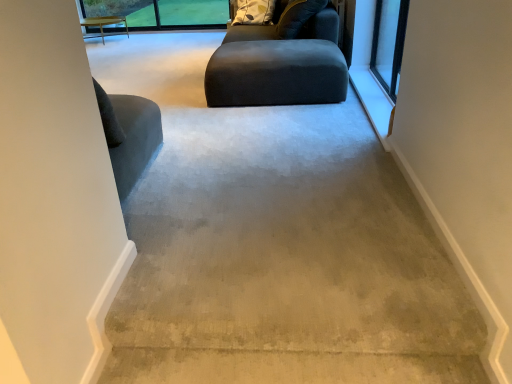
Where is `dark gray fabric bean bag at center`? The image size is (512, 384). dark gray fabric bean bag at center is located at coordinates (321, 25).

In order to click on clear glass window at upper right in this screenshot , I will do `click(389, 43)`.

The width and height of the screenshot is (512, 384). Describe the element at coordinates (389, 43) in the screenshot. I see `clear glass window at upper right` at that location.

Find the location of a particular element. This screenshot has height=384, width=512. patterned fabric pillow at upper center is located at coordinates (254, 12).

At what (x,y) coordinates should I click in order to perform the action: click on matte black ottoman at center. Please return your answer as a coordinate pair (x, y). Image resolution: width=512 pixels, height=384 pixels. Looking at the image, I should click on (278, 66).

Find the location of a particular element. dark gray fabric bean bag at center is located at coordinates (321, 25).

Is matte black ottoman at center bigger or smaller than light wood table at upper left?

matte black ottoman at center is bigger than light wood table at upper left.

Is matte black ottoman at center looking in the opposite direction of light wood table at upper left?

matte black ottoman at center does not have its back to light wood table at upper left.

From a real-world perspective, which is physically above, matte black ottoman at center or light wood table at upper left?

matte black ottoman at center.

Considering the positions of objects matte black ottoman at center and light wood table at upper left in the image provided, who is behind, matte black ottoman at center or light wood table at upper left?

Positioned behind is light wood table at upper left.

Considering the positions of objects patterned fabric pillow at upper center and clear glass window at upper right in the image provided, who is more to the left, patterned fabric pillow at upper center or clear glass window at upper right?

From the viewer's perspective, patterned fabric pillow at upper center appears more on the left side.

From the image's perspective, would you say patterned fabric pillow at upper center is positioned over clear glass window at upper right?

Yes.

Where is `window below the patterned fabric pillow at upper center (from the image's perspective)`? This screenshot has width=512, height=384. window below the patterned fabric pillow at upper center (from the image's perspective) is located at coordinates (389, 43).

Would you say patterned fabric pillow at upper center is inside or outside clear glass window at upper right?

patterned fabric pillow at upper center is not enclosed by clear glass window at upper right.

Locate an element on the screen. window lying above the matte black ottoman at center (from the image's perspective) is located at coordinates (389, 43).

Is matte black ottoman at center outside of clear glass window at upper right?

Indeed, matte black ottoman at center is completely outside clear glass window at upper right.

Which is more to the right, matte black ottoman at center or clear glass window at upper right?

Result: From the viewer's perspective, clear glass window at upper right appears more on the right side.

Does matte black ottoman at center touch clear glass window at upper right?

No, matte black ottoman at center is not touching clear glass window at upper right.

Which point is more forward, (296, 46) or (259, 6)?

Positioned in front is point (296, 46).

Considering the relative sizes of matte black ottoman at center and patterned fabric pillow at upper center in the image provided, is matte black ottoman at center bigger than patterned fabric pillow at upper center?

Correct, matte black ottoman at center is larger in size than patterned fabric pillow at upper center.

From the image's perspective, would you say matte black ottoman at center is positioned over patterned fabric pillow at upper center?

No, from the image's perspective, matte black ottoman at center is not above patterned fabric pillow at upper center.

Can you confirm if matte black ottoman at center is taller than patterned fabric pillow at upper center?

Correct, matte black ottoman at center is much taller as patterned fabric pillow at upper center.

Is light wood table at upper left shorter than dark gray fabric bean bag at center?

Yes, light wood table at upper left is shorter than dark gray fabric bean bag at center.

From the image's perspective, is light wood table at upper left beneath dark gray fabric bean bag at center?

No, from the image's perspective, light wood table at upper left is not below dark gray fabric bean bag at center.

Is light wood table at upper left not within dark gray fabric bean bag at center?

Yes, light wood table at upper left is not within dark gray fabric bean bag at center.

Would you say matte black ottoman at center is outside dark gray fabric bean bag at center?

Yes, matte black ottoman at center is located beyond the bounds of dark gray fabric bean bag at center.

From a real-world perspective, who is located higher, matte black ottoman at center or dark gray fabric bean bag at center?

From a 3D spatial view, dark gray fabric bean bag at center is above.

From the picture: Is matte black ottoman at center far away from dark gray fabric bean bag at center?

matte black ottoman at center is actually quite close to dark gray fabric bean bag at center.

From the image's perspective, between clear glass window at upper right and light wood table at upper left, which one is located above?

light wood table at upper left is shown above in the image.

Which object is thinner, clear glass window at upper right or light wood table at upper left?

clear glass window at upper right.

From a real-world perspective, which object stands above the other?

clear glass window at upper right, from a real-world perspective.

In the image, there is a matte black ottoman at center. Identify the location of table below it (from a real-world perspective). (104, 23).

At what (x,y) coordinates should I click in order to perform the action: click on pillow above the clear glass window at upper right (from a real-world perspective). Please return your answer as a coordinate pair (x, y). This screenshot has width=512, height=384. Looking at the image, I should click on point(254,12).

Looking at the image, which one is located further to matte black ottoman at center, light wood table at upper left or patterned fabric pillow at upper center?

Among the two, light wood table at upper left is located further to matte black ottoman at center.

Based on their spatial positions, is dark gray fabric bean bag at center or light wood table at upper left further from clear glass window at upper right?

The object further to clear glass window at upper right is light wood table at upper left.

Looking at the image, which one is located closer to light wood table at upper left, clear glass window at upper right or dark gray fabric bean bag at center?

dark gray fabric bean bag at center is closer to light wood table at upper left.

Consider the image. Based on their spatial positions, is clear glass window at upper right or dark gray fabric bean bag at center closer to matte black ottoman at center?

The object closer to matte black ottoman at center is dark gray fabric bean bag at center.

Estimate the real-world distances between objects in this image. Which object is further from matte black ottoman at center, dark gray fabric bean bag at center or light wood table at upper left?

Based on the image, light wood table at upper left appears to be further to matte black ottoman at center.

Looking at the image, which one is located further to dark gray fabric bean bag at center, patterned fabric pillow at upper center or light wood table at upper left?

Based on the image, light wood table at upper left appears to be further to dark gray fabric bean bag at center.

When comparing their distances from clear glass window at upper right, does patterned fabric pillow at upper center or light wood table at upper left seem closer?

Among the two, patterned fabric pillow at upper center is located nearer to clear glass window at upper right.

Which object lies nearer to the anchor point clear glass window at upper right, dark gray fabric bean bag at center or patterned fabric pillow at upper center?

dark gray fabric bean bag at center.

At what (x,y) coordinates should I click in order to perform the action: click on studio couch between clear glass window at upper right and patterned fabric pillow at upper center along the z-axis. Please return your answer as a coordinate pair (x, y). Looking at the image, I should click on (278, 66).

Find the location of `pillow between light wood table at upper left and matte black ottoman at center`. pillow between light wood table at upper left and matte black ottoman at center is located at coordinates (254, 12).

I want to click on studio couch between light wood table at upper left and dark gray fabric bean bag at center from left to right, so click(x=278, y=66).

Image resolution: width=512 pixels, height=384 pixels. Find the location of `bean bag chair positioned between matte black ottoman at center and patterned fabric pillow at upper center from near to far`. bean bag chair positioned between matte black ottoman at center and patterned fabric pillow at upper center from near to far is located at coordinates (321, 25).